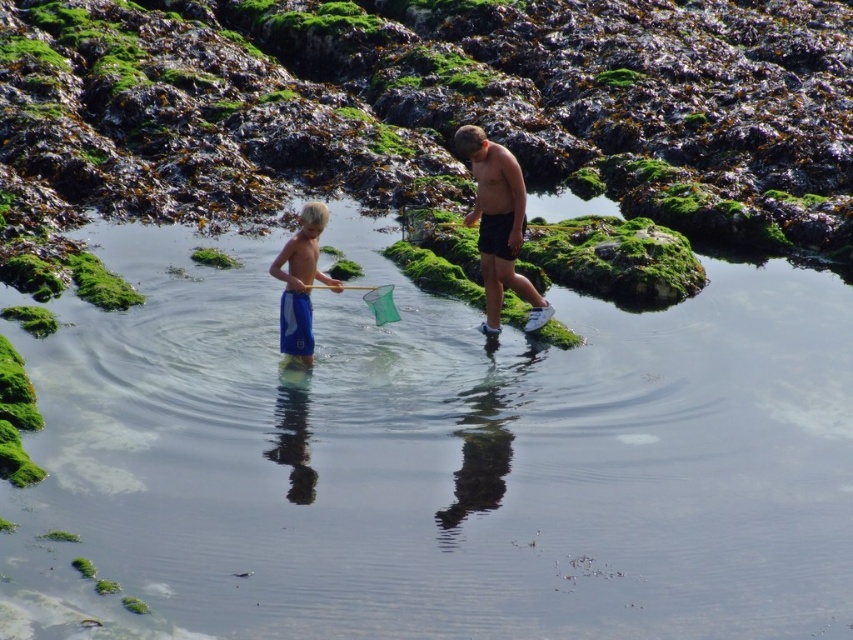
Is point (228, 256) farther from viewer compared to point (633, 70)?

No, it is in front of (633, 70).

Between point (206, 250) and point (624, 74), which one is positioned behind?

Point (624, 74)

Between point (218, 260) and point (614, 84), which one is positioned behind?

The point (614, 84) is more distant.

What are the coordinates of `green mossy algae at center` in the screenshot? It's located at (213, 257).

Does point (509, 212) come farther from viewer compared to point (213, 260)?

No, it is not.

This screenshot has height=640, width=853. What do you see at coordinates (498, 225) in the screenshot? I see `skinny white shorts at center` at bounding box center [498, 225].

You are a GUI agent. You are given a task and a screenshot of the screen. Output one action in this format:
    pyautogui.click(x=<x>, y=<y>)
    Task: Click on the skinny white shorts at center
    The height and width of the screenshot is (640, 853).
    Given the screenshot: What is the action you would take?
    pyautogui.click(x=498, y=225)

Between clear water at center and skinny white shorts at center, which one is positioned lower?

Positioned lower is clear water at center.

Is clear water at center below skinny white shorts at center?

Yes.

Does point (596, 332) come farther from viewer compared to point (498, 317)?

Yes, point (596, 332) is farther from viewer.

What are the coordinates of `clear water at center` in the screenshot? It's located at (434, 458).